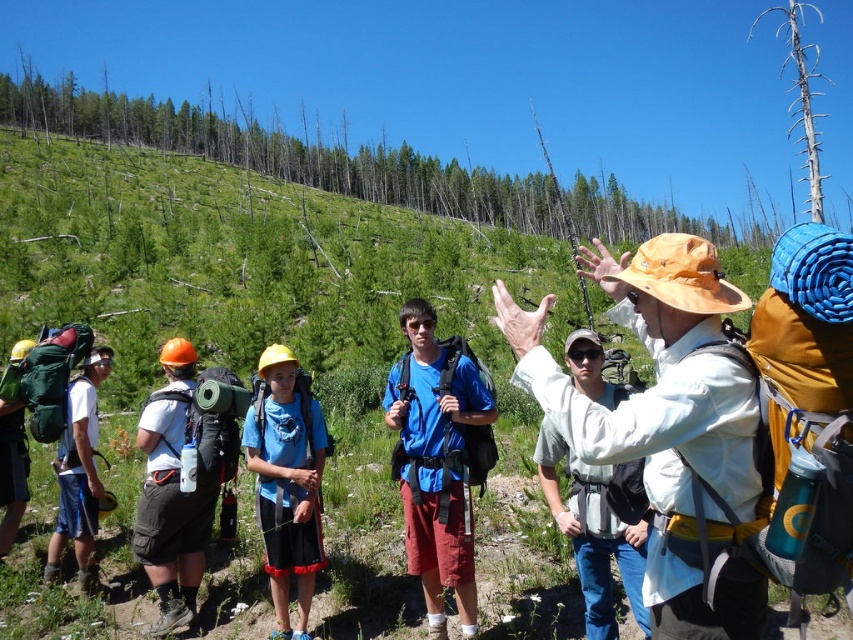
Question: Does matte blue t-shirt at center have a lesser width compared to brushed metal backpack at left?

Choices:
 (A) no
 (B) yes

Answer: (A)

Question: Which is nearer to the brushed metal backpack at left?

Choices:
 (A) matte green backpack at left
 (B) matte black backpack at left
 (C) matte blue t-shirt at center
 (D) blue matte shirt at center

Answer: (A)

Question: Which of the following is the closest to the observer?

Choices:
 (A) white matte shirt at center
 (B) matte green backpack at left

Answer: (A)

Question: Which point appears closest to the camera in this image?

Choices:
 (A) (276, 456)
 (B) (529, 349)

Answer: (B)

Question: In this image, where is matte blue t-shirt at center located relative to white matte shirt at center?

Choices:
 (A) below
 (B) above

Answer: (B)

Question: In this image, where is matte blue t-shirt at center located relative to white matte shirt at center?

Choices:
 (A) below
 (B) above

Answer: (B)